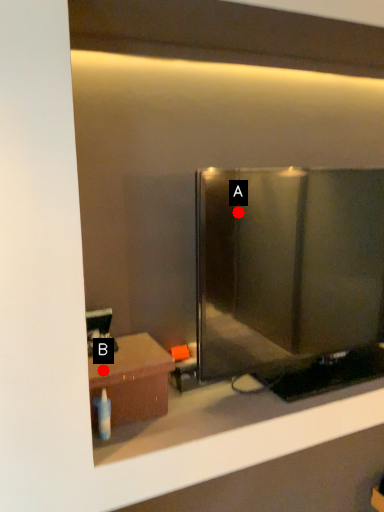
Question: Two points are circled on the image, labeled by A and B beside each circle. Which of the following is the farthest from the observer?

Choices:
 (A) A is further
 (B) B is further

Answer: (A)